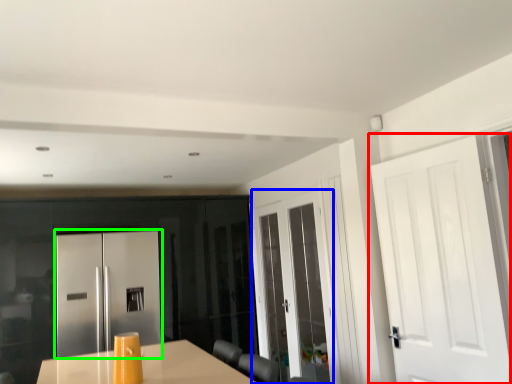
Question: Which object is the closest to the door (highlighted by a red box)? Choose among these: door (highlighted by a blue box) or door (highlighted by a green box).

Choices:
 (A) door
 (B) door

Answer: (A)